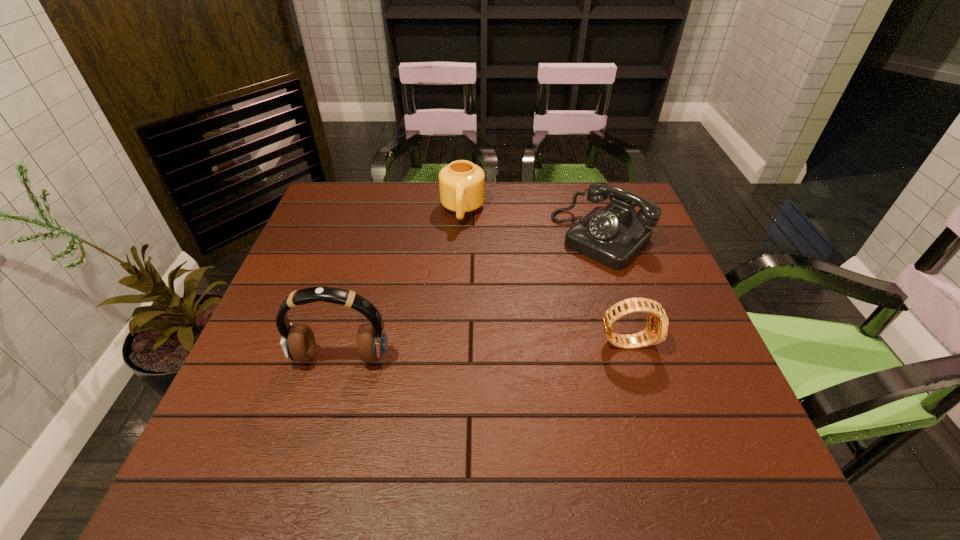
You are a GUI agent. You are given a task and a screenshot of the screen. Output one action in this format:
    pyautogui.click(x=<x>, y=<y>)
    Task: Click on the vacant space on the desktop that is between the headset and the watch and is positioned on the dial of the telephone
    The width and height of the screenshot is (960, 540).
    Given the screenshot: What is the action you would take?
    pyautogui.click(x=478, y=350)

Where is `vacant spot on the desktop that is between the tallest object and the watch and is positioned on the handle side of the mug`? The image size is (960, 540). vacant spot on the desktop that is between the tallest object and the watch and is positioned on the handle side of the mug is located at coordinates (445, 352).